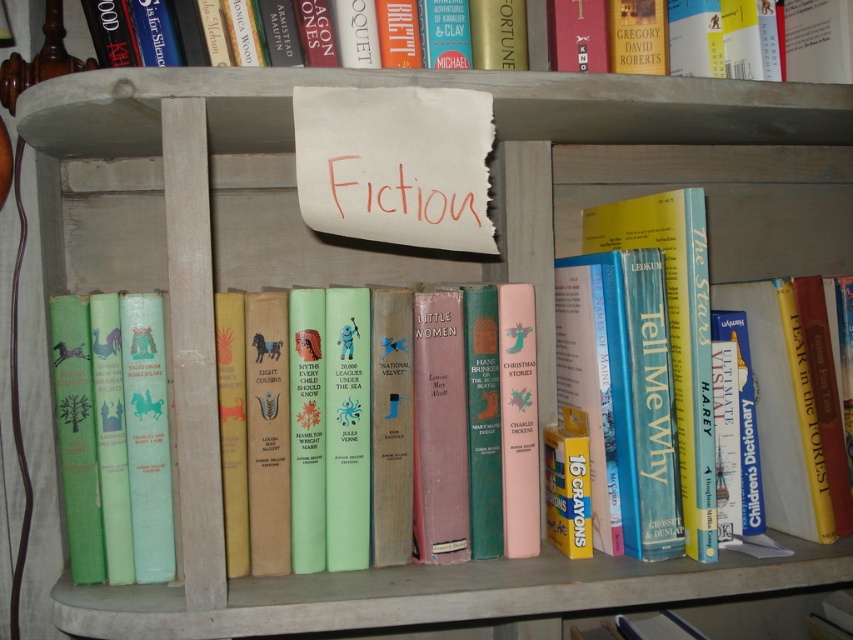
You are organizing books on the shelf and need to place a new book that is 15 cm thick. The blue hardcover book at center and the hardcover book at upper center are already on the shelf. Which book can accommodate the new book if you want to stack them on top?

The blue hardcover book at center has a larger size compared to the hardcover book at upper center, so it can accommodate the new 15 cm thick book when stacked.